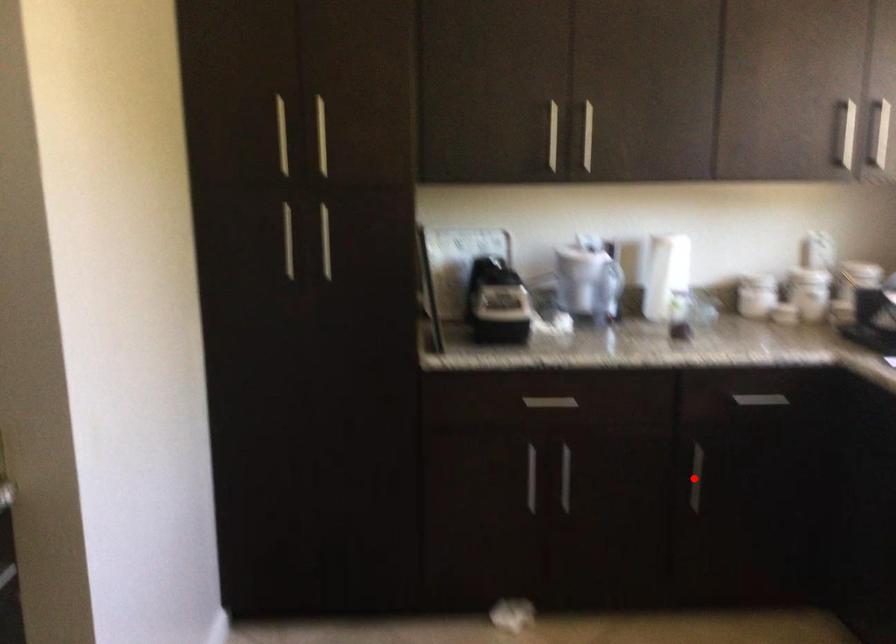
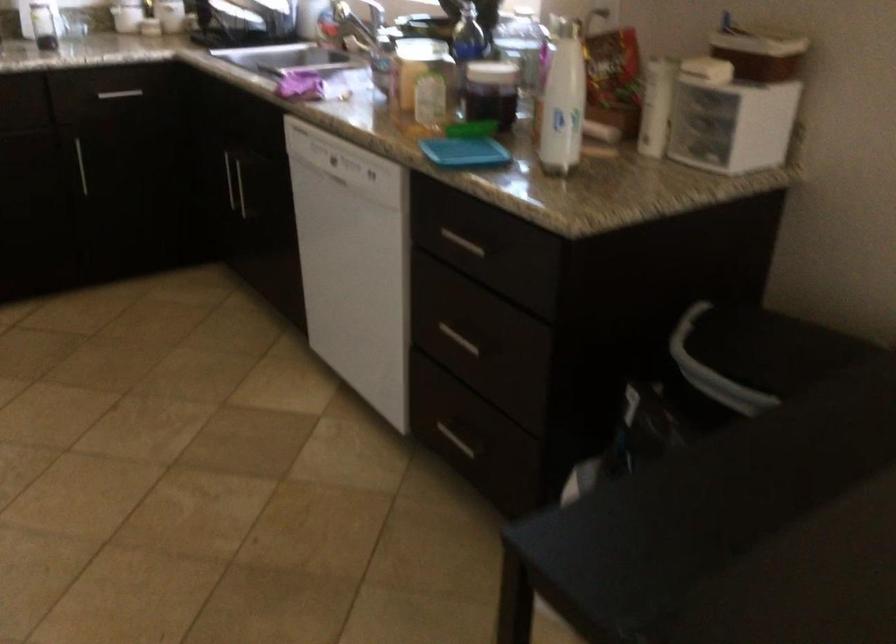
In the second image, find the point that corresponds to the highlighted location in the first image.

(81, 166)